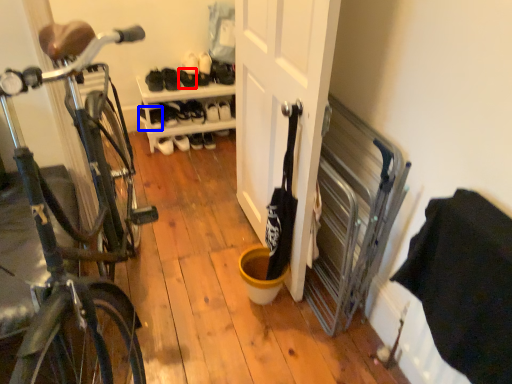
Question: Which of the following is the closest to the observer, shoe (highlighted by a red box) or shoe (highlighted by a blue box)?

Choices:
 (A) shoe
 (B) shoe

Answer: (A)